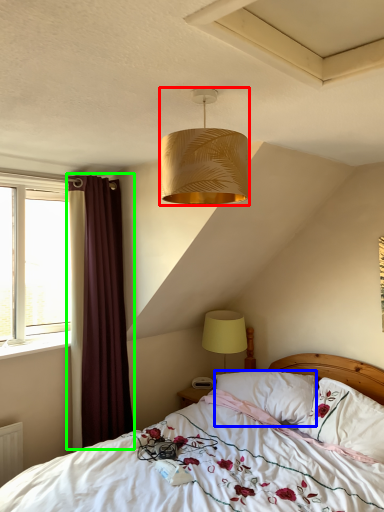
Question: Which object is the closest to the lamp (highlighted by a red box)? Choose among these: pillow (highlighted by a blue box) or curtain (highlighted by a green box).

Choices:
 (A) pillow
 (B) curtain

Answer: (B)